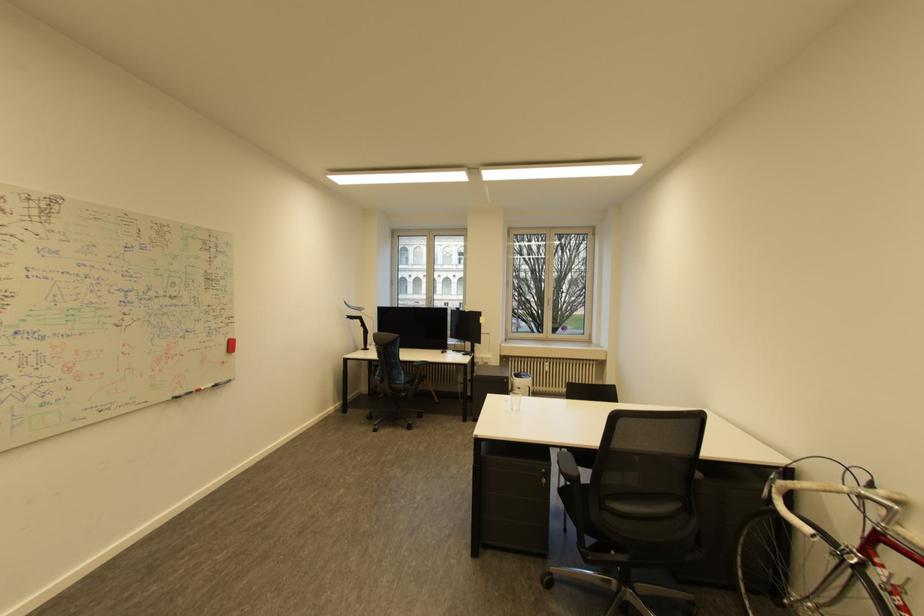
You are a GUI agent. You are given a task and a screenshot of the screen. Output one action in this format:
    pyautogui.click(x=<x>, y=<y>)
    Task: Click on the cabinet drawer handle
    The height and width of the screenshot is (616, 924).
    Given the screenshot: What is the action you would take?
    pyautogui.click(x=543, y=472)